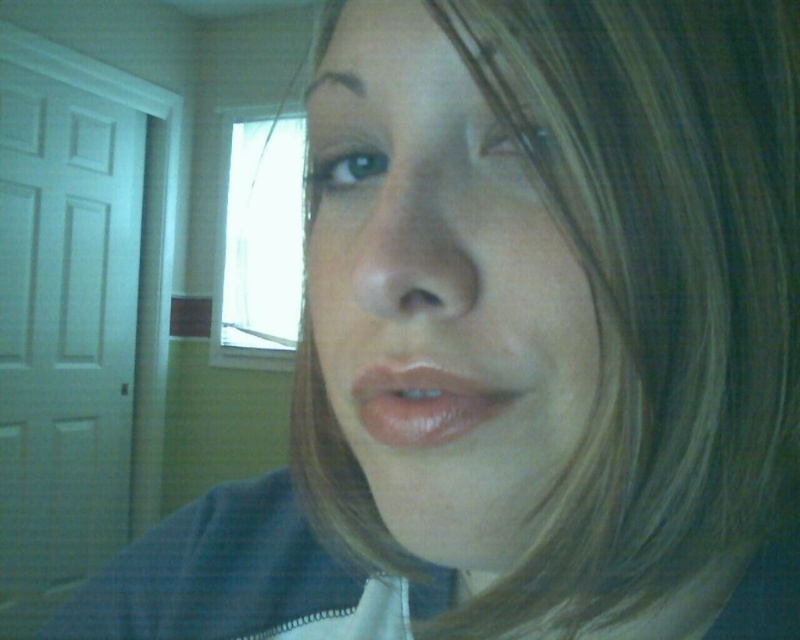
Question: Which point is closer to the camera?

Choices:
 (A) smooth skin face at center
 (B) shiny pink lips at center

Answer: (A)

Question: Is smooth skin face at center thinner than shiny pink lips at center?

Choices:
 (A) yes
 (B) no

Answer: (B)

Question: Is smooth skin face at center wider than shiny pink lips at center?

Choices:
 (A) no
 (B) yes

Answer: (B)

Question: Can you confirm if smooth skin face at center is thinner than shiny pink lips at center?

Choices:
 (A) yes
 (B) no

Answer: (B)

Question: Which object appears farthest from the camera in this image?

Choices:
 (A) smooth skin face at center
 (B) shiny pink lips at center

Answer: (B)